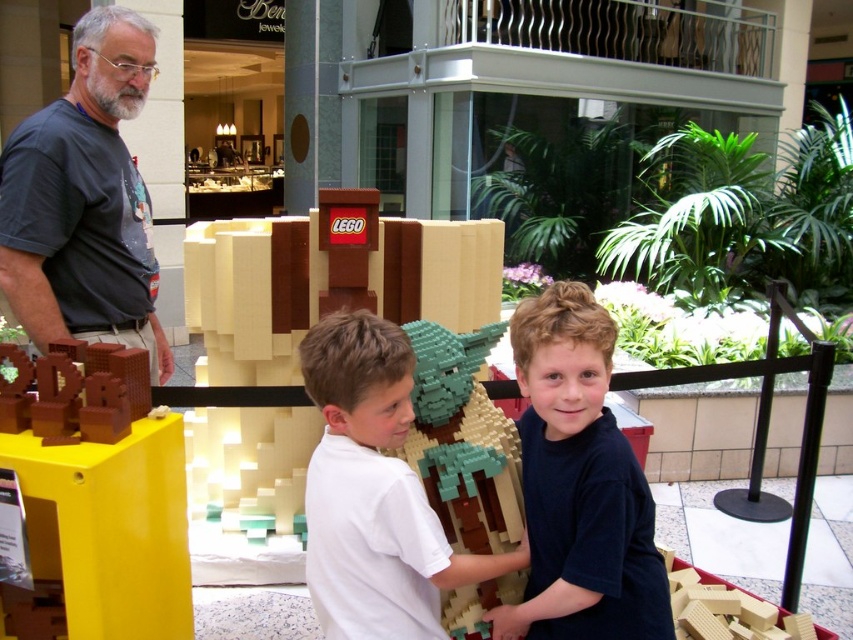
You are a security camera positioned at the center of the mall. You need to identify the location of the dark blue shirt at center relative to the LEGO sculpture. Is it to the left, right, front, or back of the sculpture?

The dark blue shirt at center is located at point (579, 484) relative to the LEGO sculpture. Based on the coordinates, it is positioned to the right of the sculpture.